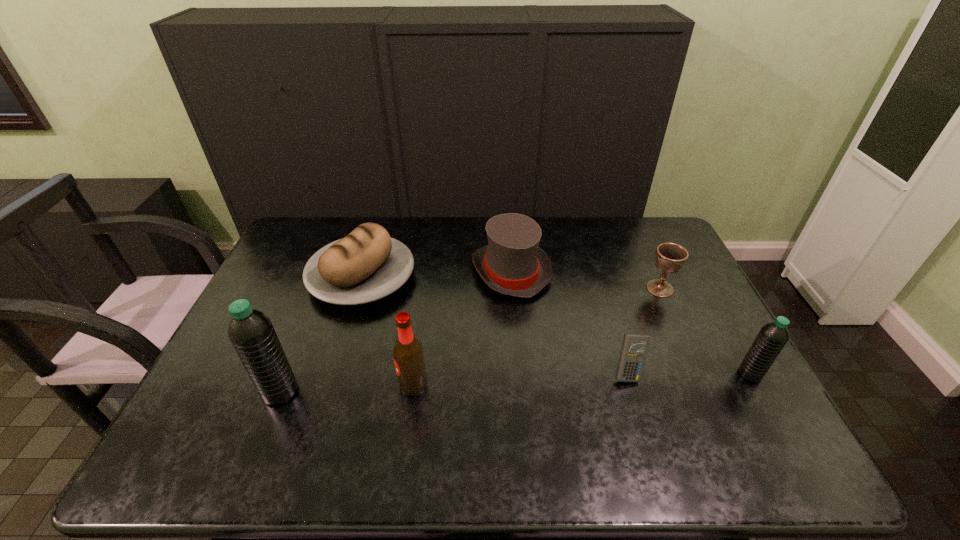
I want to click on free space between the tallest object and the fifth object from left to right, so click(454, 382).

Where is `empty location between the beer bottle and the left water bottle`? Image resolution: width=960 pixels, height=540 pixels. empty location between the beer bottle and the left water bottle is located at coordinates (347, 388).

This screenshot has height=540, width=960. Find the location of `vacant space in between the rightmost object and the third object from right to left`. vacant space in between the rightmost object and the third object from right to left is located at coordinates click(688, 374).

Identify the location of the fourth closest object to the left water bottle. The height and width of the screenshot is (540, 960). (634, 346).

This screenshot has height=540, width=960. Identify the location of object that can be found as the fifth closest to the right water bottle. (366, 265).

What are the coordinates of `free spot that satisfies the following two spatial constraints: 1. on the front side of the bread; 2. on the left side of the fifth shortest object` in the screenshot? It's located at (332, 374).